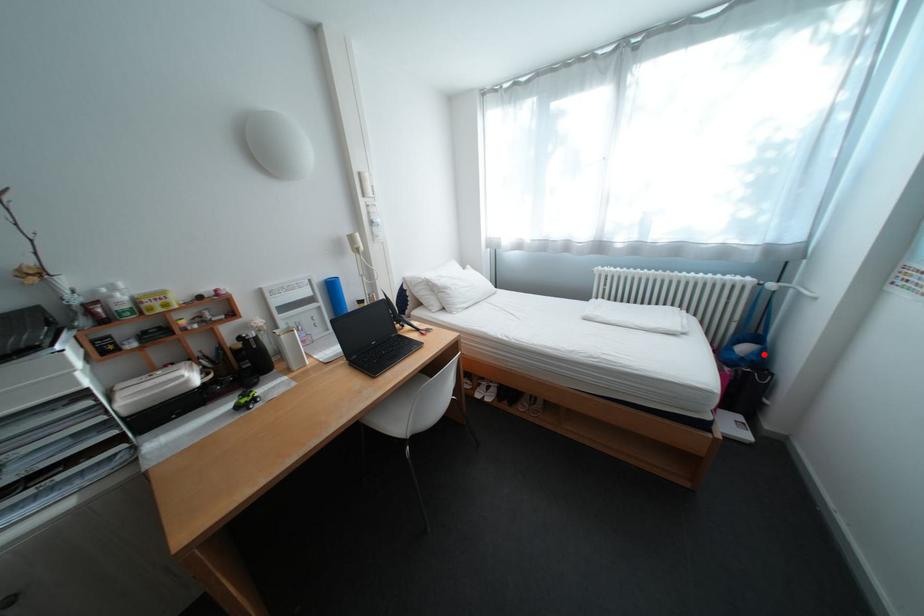
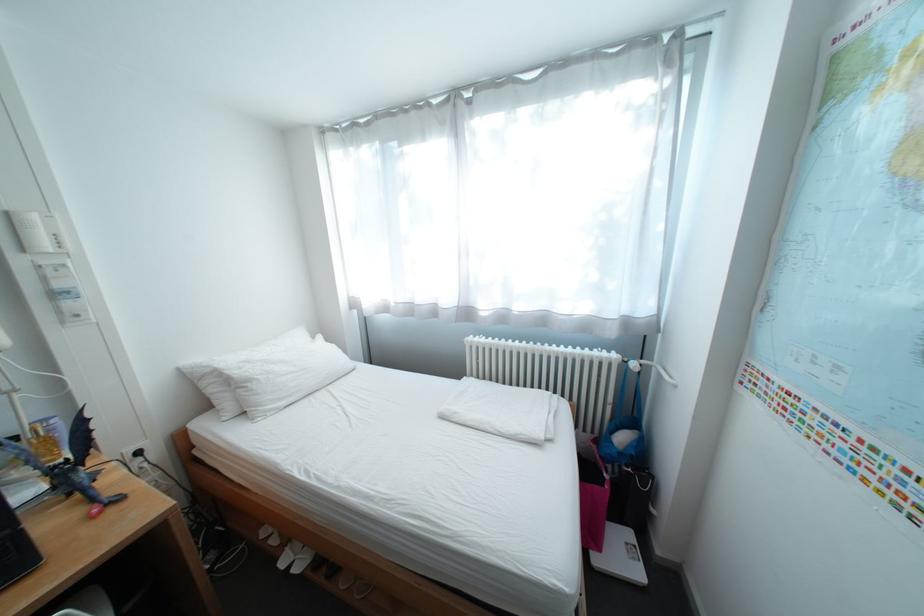
The point at the highlighted location is marked in the first image. Where is the corresponding point in the second image?

(642, 447)